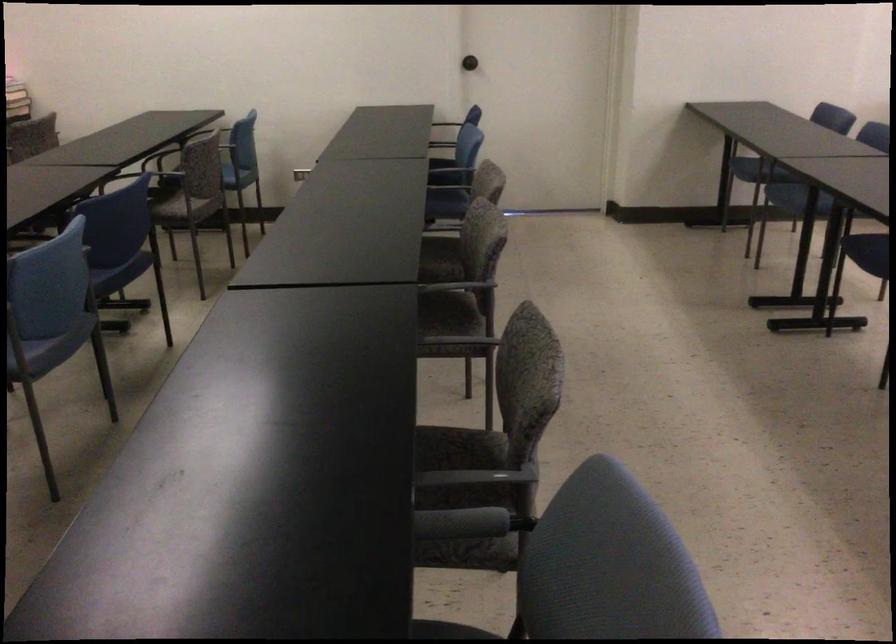
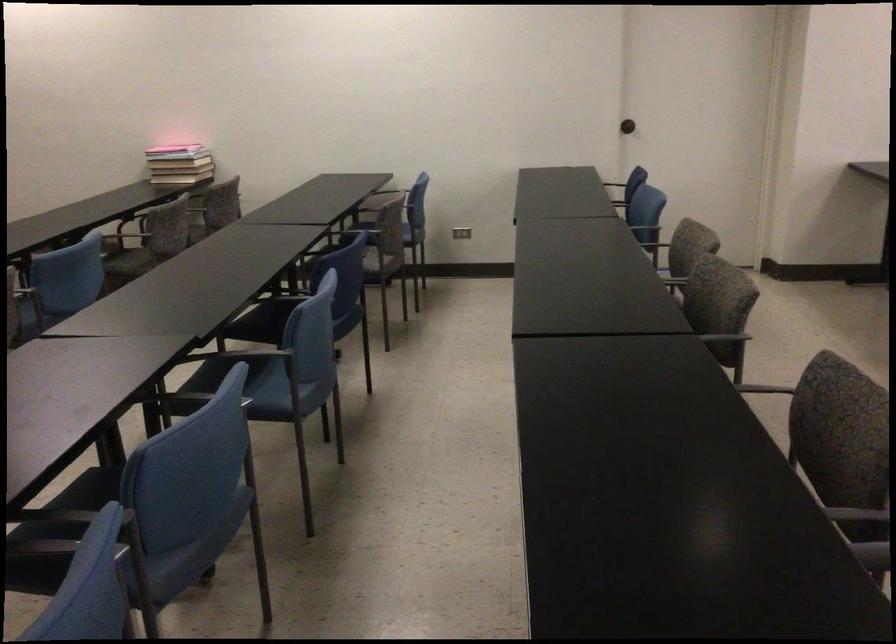
The point at (296, 175) is marked in the first image. Where is the corresponding point in the second image?

(461, 232)